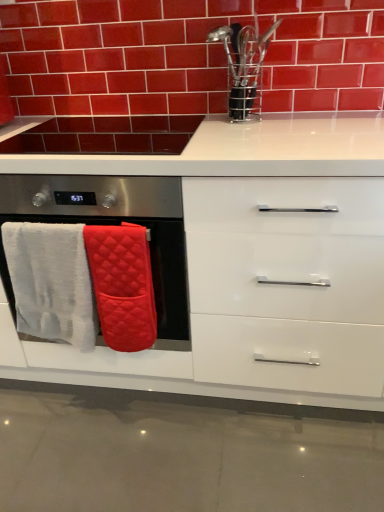
Question: From a real-world perspective, is glossy ceramic brick at upper center positioned above or below white glossy cabinet at center?

Choices:
 (A) below
 (B) above

Answer: (B)

Question: Is glossy ceramic brick at upper center wider or thinner than white glossy cabinet at center?

Choices:
 (A) wide
 (B) thin

Answer: (B)

Question: Considering the real-world distances, which object is farthest from the quilted cotton bath towel at left, which is counted as the 2th bath towel, starting from the left?

Choices:
 (A) white quilted oven mitts at left
 (B) white fluffy bath towel at left, arranged as the second bath towel when viewed from the right
 (C) white glossy cabinet at center
 (D) glossy ceramic brick at upper center

Answer: (D)

Question: Estimate the real-world distances between objects in this image. Which object is farther from the quilted cotton bath towel at left, acting as the first bath towel starting from the right?

Choices:
 (A) white glossy cabinet at center
 (B) white quilted oven mitts at left
 (C) glossy ceramic brick at upper center
 (D) white fluffy bath towel at left, the first bath towel when ordered from left to right

Answer: (C)